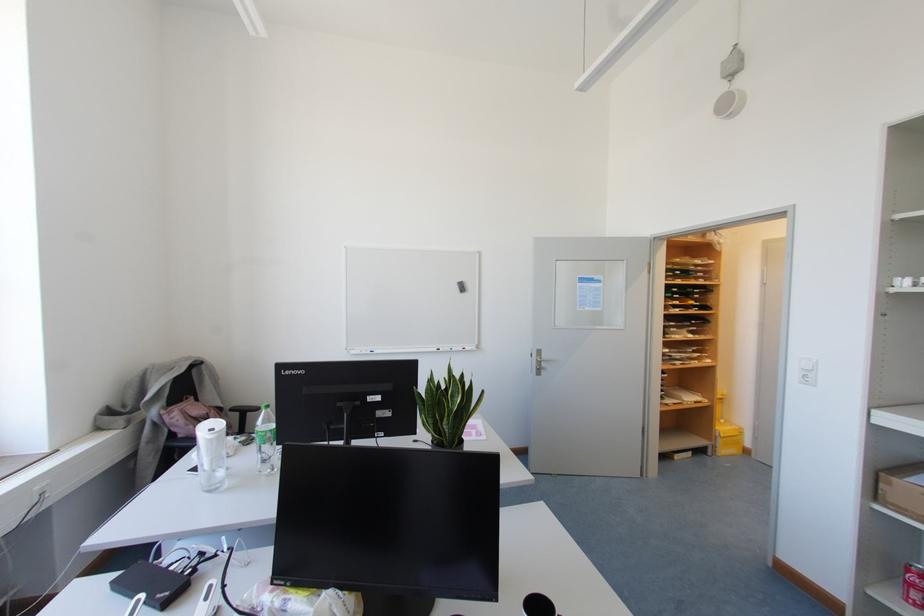
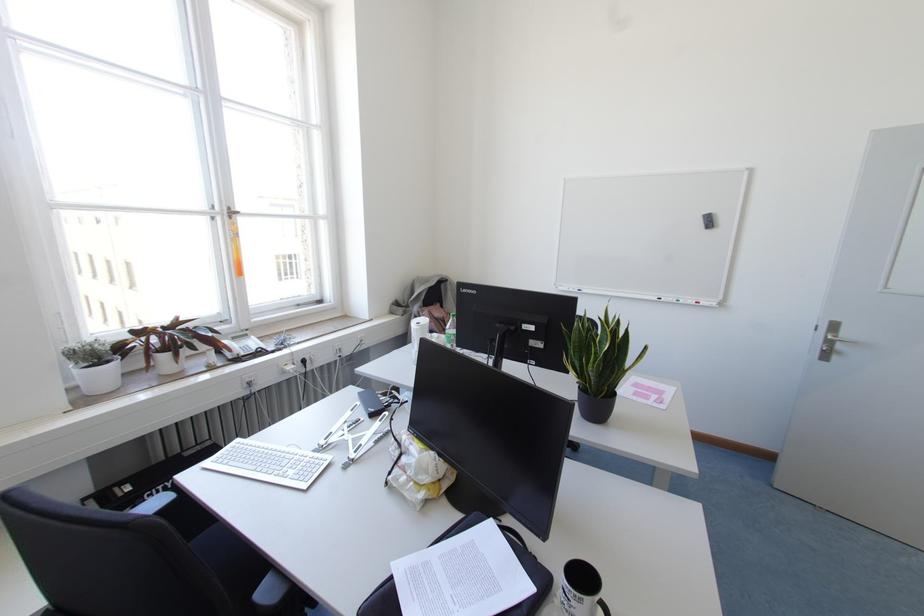
Locate, in the second image, the point that corresponds to [463,347] in the first image.

(696, 302)